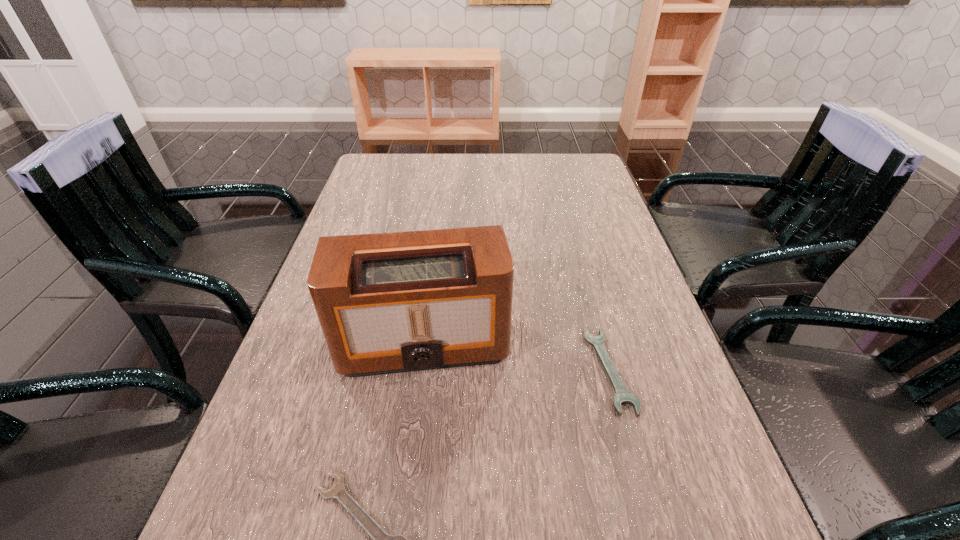
I want to click on radio receiver, so click(x=395, y=302).

Locate an element on the screen. This screenshot has height=540, width=960. the farther wrench is located at coordinates [622, 396].

Locate an element on the screen. the right wrench is located at coordinates (622, 396).

I want to click on free location located 0.350m on the back of the tallest object, so click(439, 221).

Where is `vacant space located 0.050m on the left of the rightmost object`? This screenshot has width=960, height=540. vacant space located 0.050m on the left of the rightmost object is located at coordinates (564, 370).

The height and width of the screenshot is (540, 960). Identify the location of object that is at the left edge. (395, 302).

The width and height of the screenshot is (960, 540). In order to click on object at the right edge in this screenshot , I will do `click(622, 396)`.

Find the location of a particular element. The height and width of the screenshot is (540, 960). vacant space at the far edge of the desktop is located at coordinates pyautogui.click(x=447, y=172).

This screenshot has height=540, width=960. In the image, there is a desktop. What are the coordinates of `free space at the left edge` in the screenshot? It's located at (395, 212).

Where is `vacant space at the right edge of the desktop`? The height and width of the screenshot is (540, 960). vacant space at the right edge of the desktop is located at coordinates (569, 235).